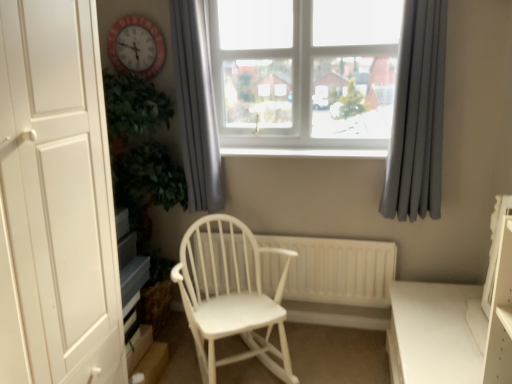
Find the location of a particular element. The width and height of the screenshot is (512, 384). free space above white glossy table at lower right (from a real-world perspective) is located at coordinates (441, 318).